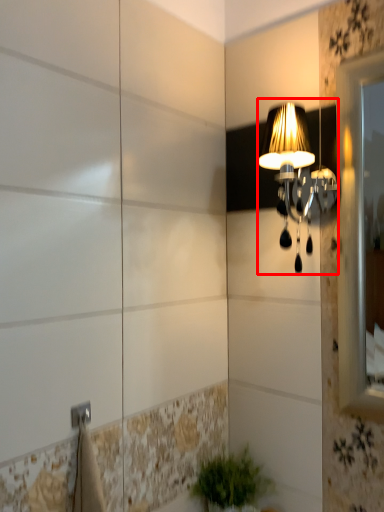
Question: In this image, where is lamp (annotated by the red box) located relative to houseplant?

Choices:
 (A) left
 (B) right

Answer: (B)